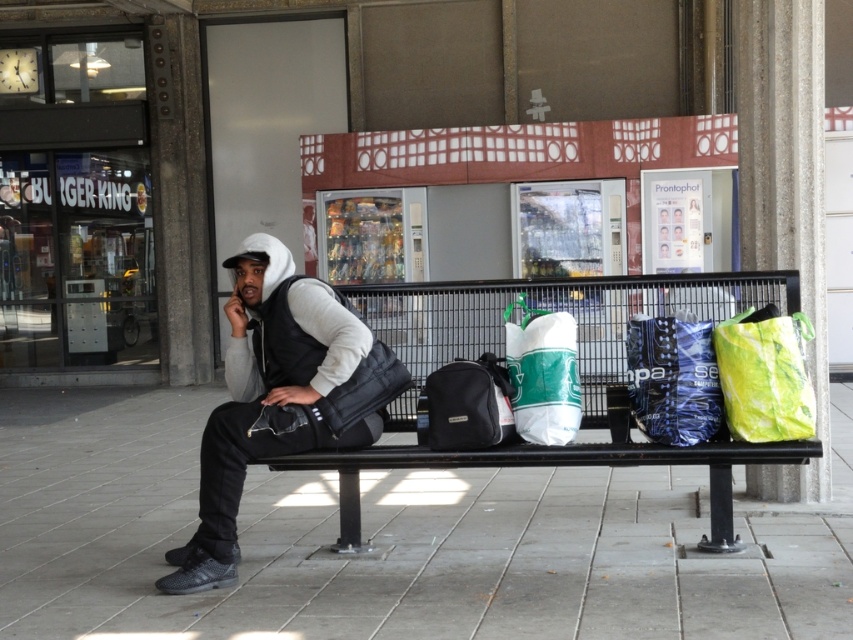
Question: Estimate the real-world distances between objects in this image. Which object is farther from the black leather bench at center?

Choices:
 (A) green plastic bag at right
 (B) green matte shopping bag at center
 (C) matte black jacket at center
 (D) blue matte bag at right

Answer: (C)

Question: Which object is the closest to the green matte shopping bag at center?

Choices:
 (A) matte black jacket at center
 (B) green plastic bag at right
 (C) black leather bench at center

Answer: (C)

Question: Is the position of green plastic bag at right more distant than that of green matte shopping bag at center?

Choices:
 (A) yes
 (B) no

Answer: (B)

Question: Among these objects, which one is nearest to the camera?

Choices:
 (A) black leather bench at center
 (B) green matte shopping bag at center
 (C) blue matte bag at right

Answer: (A)

Question: Does matte black jacket at center appear over black leather bench at center?

Choices:
 (A) no
 (B) yes

Answer: (B)

Question: Does matte black jacket at center have a lesser width compared to black leather bench at center?

Choices:
 (A) no
 (B) yes

Answer: (B)